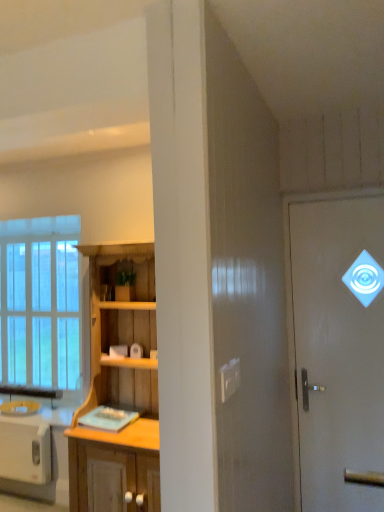
Locate an element on the screen. The width and height of the screenshot is (384, 512). free space above clear glass window at left (from a real-world perspective) is located at coordinates (34, 234).